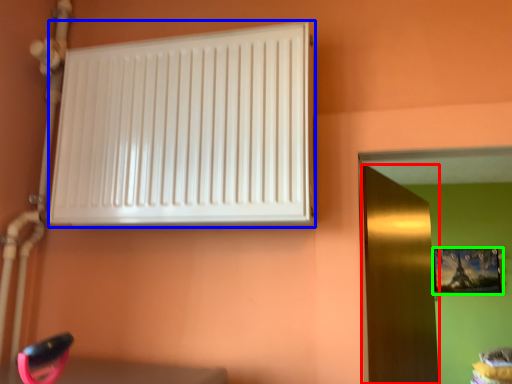
Question: Considering the real-world distances, which object is closest to door (highlighted by a red box)? radiator (highlighted by a blue box) or picture frame (highlighted by a green box).

Choices:
 (A) radiator
 (B) picture frame

Answer: (A)